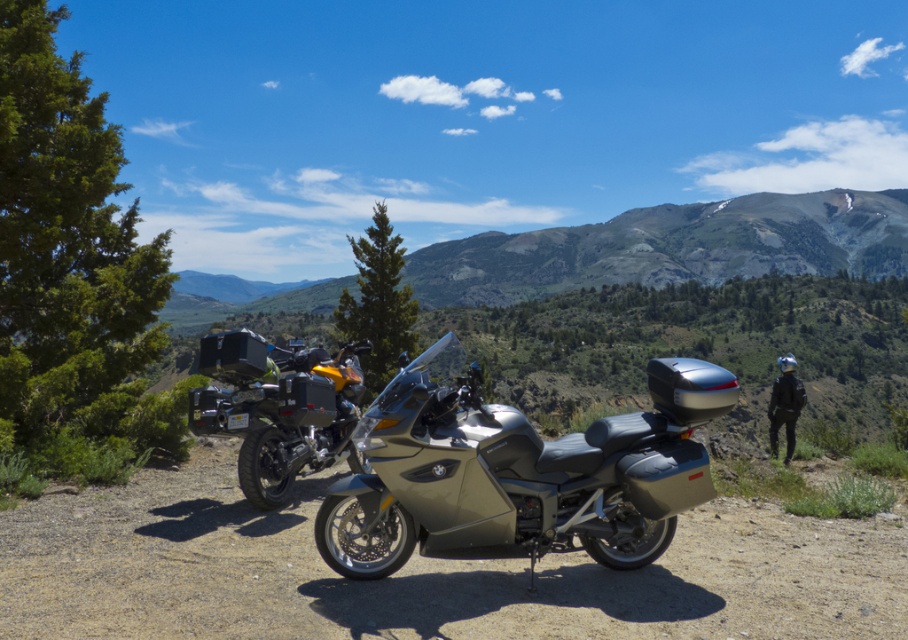
You are standing at the point marked by the coordinates point (410, 484). You want to walk towards the two motorcycles. Which motorcycle will you see first as you approach them?

The motorcycle closer to the point 0.759, 0452 will be seen first. However, the description does not specify which motorcycle is closer to the point. Please provide more details.

You are a photographer planning to take a picture of the matte black motorcycle at center and the gray gravel dirt track at center. If you want to ensure both are in focus, which part of the scene should you focus on first?

The gray gravel dirt track at center is below the matte black motorcycle at center, so you should focus on the matte black motorcycle at center first since it is closer to the camera.

You are standing at the starting point of the gray gravel dirt track at center. If you walk straight ahead, will you eventually reach the end of the track?

The gray gravel dirt track at center is located at point (422, 572) in 2D coordinates, so walking straight ahead along it would lead you to its end.